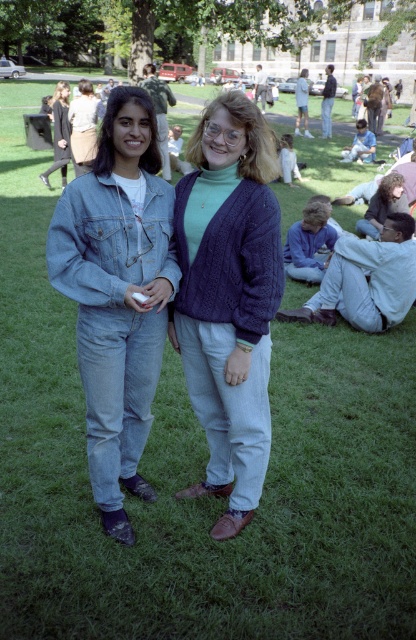
Consider the image. You are standing at the point marked as point (198,227) in the image. The woman on the left is holding a small white object in her right hand. Can you see the woman on the right wearing a green turtleneck sweater under a dark blue knitted cardigan?

Yes, the point (198,227) is 8.99 feet away from the viewer. Since the women are standing side by side on the grassy area, the viewer can see the woman on the right wearing a green turtleneck sweater under a dark blue knitted cardigan.